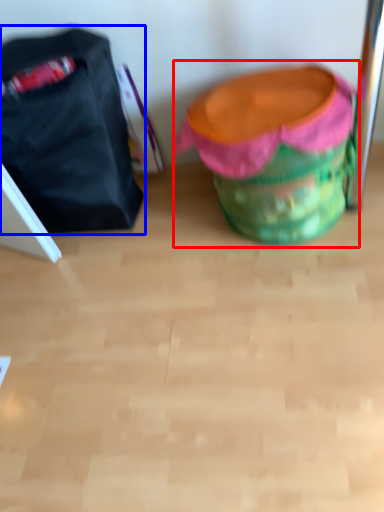
Question: Which of the following is the farthest to the observer, bean bag chair (highlighted by a red box) or luggage and bags (highlighted by a blue box)?

Choices:
 (A) bean bag chair
 (B) luggage and bags

Answer: (B)